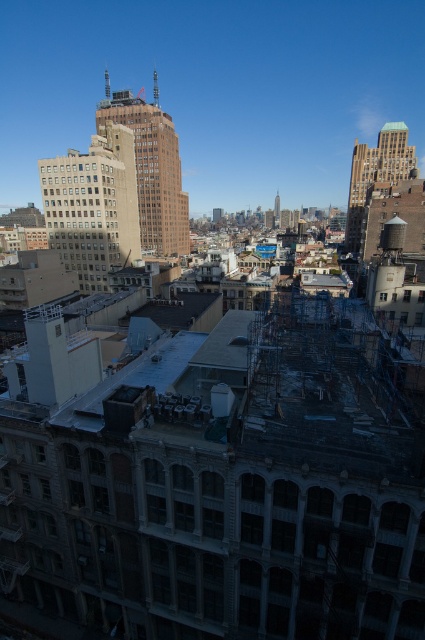
Is the position of brown brick building at upper center more distant than that of greenish-gray concrete tower at upper right?

That is False.

Is brown brick building at upper center thinner than greenish-gray concrete tower at upper right?

In fact, brown brick building at upper center might be wider than greenish-gray concrete tower at upper right.

The width and height of the screenshot is (425, 640). Identify the location of brown brick building at upper center. (152, 168).

Does matte glass building at center lie behind greenish-gray concrete tower at upper right?

That is False.

What do you see at coordinates (93, 205) in the screenshot?
I see `matte glass building at center` at bounding box center [93, 205].

Image resolution: width=425 pixels, height=640 pixels. I want to click on matte glass building at center, so click(93, 205).

Image resolution: width=425 pixels, height=640 pixels. What are the coordinates of `exposed concrete scaffolding at center` in the screenshot? It's located at (221, 476).

Between exposed concrete scaffolding at center and matte glass building at center, which one is positioned higher?

matte glass building at center is higher up.

Which is in front, point (59, 552) or point (124, 202)?

Point (59, 552) is more forward.

Locate an element on the screen. exposed concrete scaffolding at center is located at coordinates (x=221, y=476).